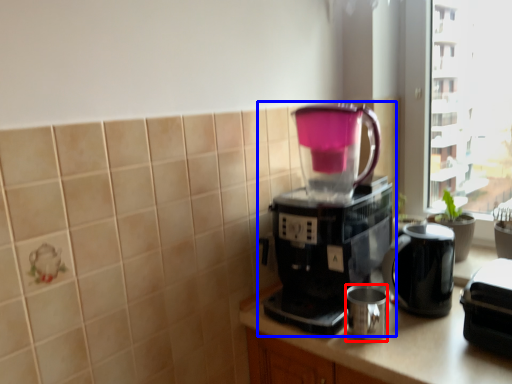
Question: Which point is closer to the camera, mug (highlighted by a red box) or coffee maker (highlighted by a blue box)?

Choices:
 (A) mug
 (B) coffee maker

Answer: (B)